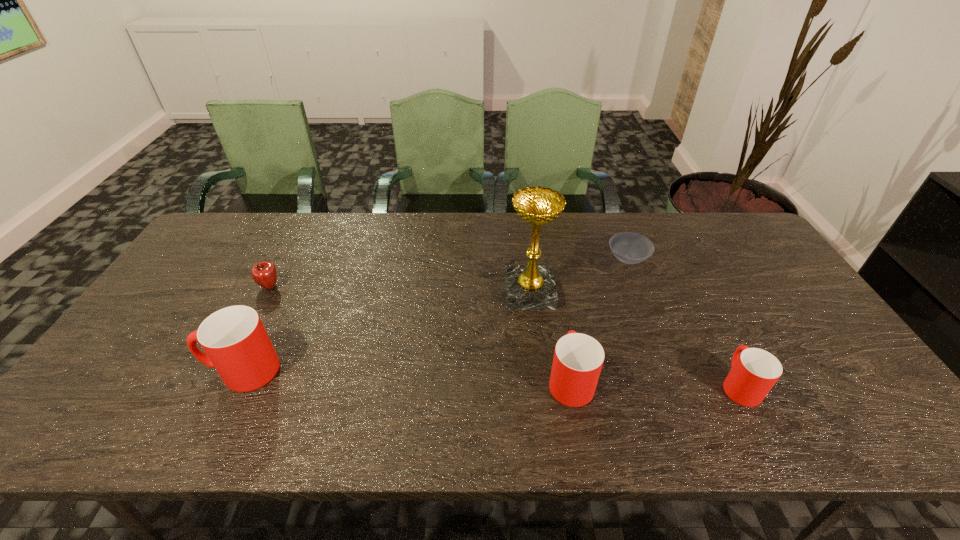
Image resolution: width=960 pixels, height=540 pixels. What are the coordinates of `the tallest cup` in the screenshot? It's located at (236, 344).

Where is `the fifth shortest object`? The image size is (960, 540). the fifth shortest object is located at coordinates (236, 344).

Locate an element on the screen. Image resolution: width=960 pixels, height=540 pixels. the second tallest cup is located at coordinates (x=578, y=358).

In order to click on the second cup from right to left in this screenshot , I will do `click(578, 358)`.

Find the location of `the shortest cup`. the shortest cup is located at coordinates (754, 372).

Locate an element on the screen. The width and height of the screenshot is (960, 540). the rightmost object is located at coordinates (754, 372).

The height and width of the screenshot is (540, 960). I want to click on bowl, so click(x=631, y=248).

At what (x,y) coordinates should I click in order to perform the action: click on the second object from right to left. Please return your answer as a coordinate pair (x, y). Image resolution: width=960 pixels, height=540 pixels. Looking at the image, I should click on (631, 248).

This screenshot has width=960, height=540. Find the location of `the tallest object`. the tallest object is located at coordinates (531, 287).

This screenshot has width=960, height=540. I want to click on the second shortest object, so click(x=264, y=273).